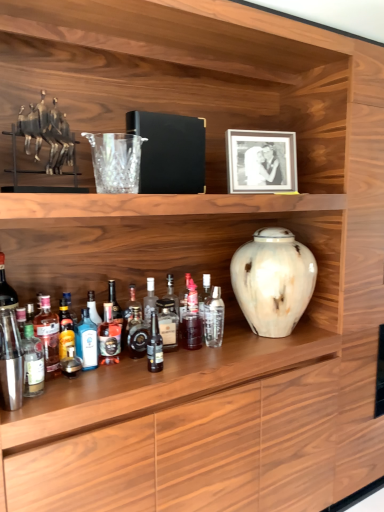
Question: Is point (97, 335) closer or farther from the camera than point (190, 305)?

Choices:
 (A) closer
 (B) farther

Answer: (A)

Question: Relative to translucent glass bottle at center, the 2th bottle positioned from the right, is blue glass bottle at center, the fifth bottle from the left, in front or behind?

Choices:
 (A) front
 (B) behind

Answer: (A)

Question: Which is farther from the translucent glass bottle at center, acting as the 7th bottle starting from the left?

Choices:
 (A) shiny dark brown bottle at center, the 6th bottle viewed from the left
 (B) matte silver picture frame at upper center
 (C) blue glass bottle at center, which is counted as the seventh bottle, starting from the right
 (D) white marble vase at center
 (E) translucent glass bottle at lower left, which ranks as the third bottle in left-to-right order

Answer: (B)

Question: Estimate the real-world distances between objects in this image. Which object is closer to the translucent glass bottle at center, positioned as the eighth bottle in left-to-right order?

Choices:
 (A) blue glass bottle at center, which is counted as the seventh bottle, starting from the right
 (B) translucent glass bottle at lower left, which ranks as the third bottle in left-to-right order
 (C) white marble vase at center
 (D) shiny metallic shaker at left, positioned as the 10th bottle in right-to-left order
 (E) clear glass bottle at center, which appears as the first bottle when viewed from the right

Answer: (E)